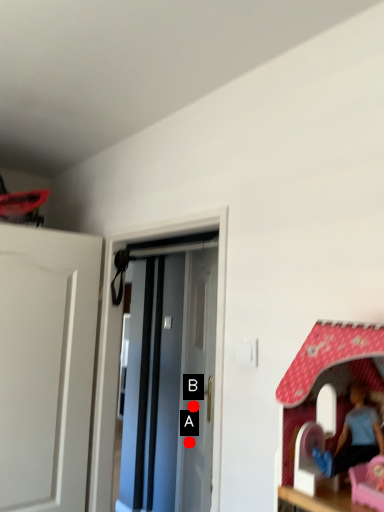
Question: Two points are circled on the image, labeled by A and B beside each circle. Which point is further to the camera?

Choices:
 (A) A is further
 (B) B is further

Answer: (A)